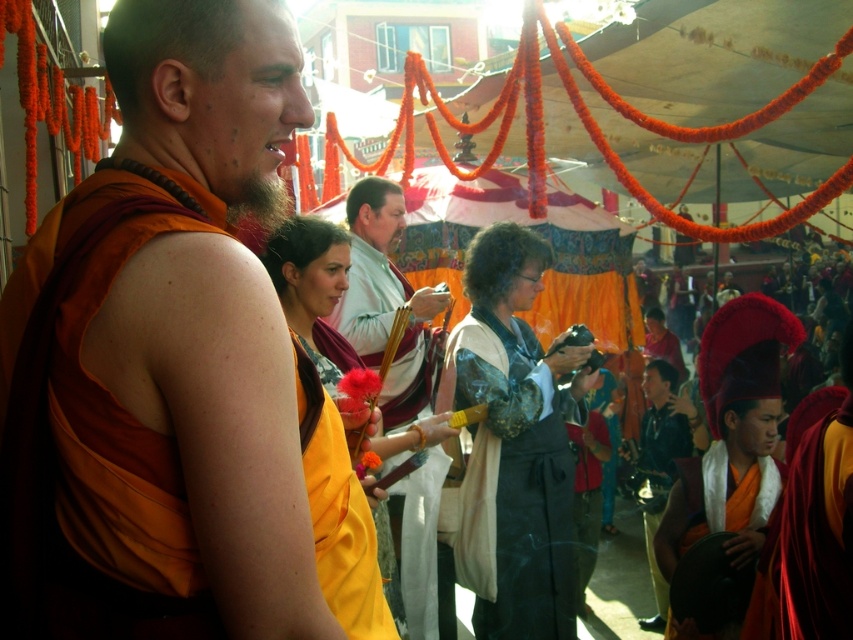
Question: Can you confirm if matte orange robe at center is positioned below matte white robe at center?

Choices:
 (A) yes
 (B) no

Answer: (A)

Question: Among these objects, which one is farthest from the camera?

Choices:
 (A) matte white robe at center
 (B) silky black robe at center
 (C) matte orange robe at center

Answer: (A)

Question: Which of the following is the closest to the observer?

Choices:
 (A) (527, 628)
 (B) (161, 252)
 (C) (347, 316)

Answer: (B)

Question: Which of the following is the farthest from the observer?

Choices:
 (A) matte white robe at center
 (B) matte orange robe at center

Answer: (A)

Question: Is matte orange robe at center wider than silky black robe at center?

Choices:
 (A) no
 (B) yes

Answer: (B)

Question: Can you confirm if silky black robe at center is smaller than matte white robe at center?

Choices:
 (A) yes
 (B) no

Answer: (A)